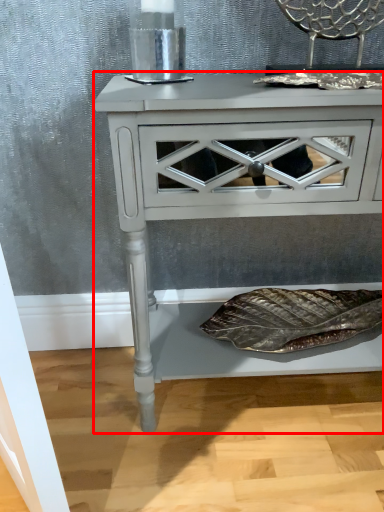
Question: From the image's perspective, where is nightstand (annotated by the red box) located relative to chair?

Choices:
 (A) below
 (B) above

Answer: (A)